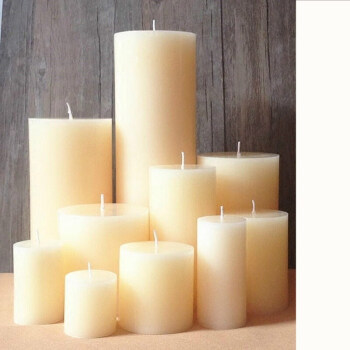
Where is `candles`? candles is located at coordinates (67, 173), (149, 109), (263, 176), (195, 192), (112, 227), (42, 255), (82, 316), (166, 289), (214, 283), (256, 269).